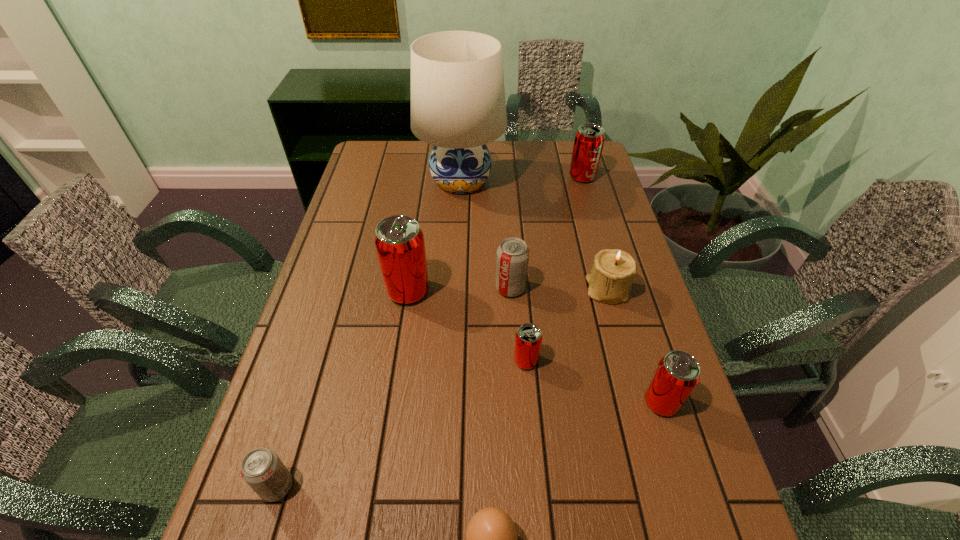
Find the location of a particular element. blank space located 0.190m on the back of the nearest red soda can is located at coordinates (636, 321).

Locate an element on the screen. This screenshot has height=540, width=960. free region located 0.080m on the left of the fourth nearest object is located at coordinates (480, 361).

Locate an element on the screen. vacant region located 0.140m on the back of the leftmost soda can is located at coordinates (301, 406).

Where is `lampshade located in the far edge section of the desktop`? Image resolution: width=960 pixels, height=540 pixels. lampshade located in the far edge section of the desktop is located at coordinates (458, 104).

Find the location of a particular element. This screenshot has height=540, width=960. soda can that is at the far edge is located at coordinates (589, 140).

Identify the location of object positioned at the left edge. (262, 469).

What are the coordinates of `candle_holder that is at the right edge` in the screenshot? It's located at (610, 280).

Locate an element on the screen. This screenshot has height=540, width=960. object that is at the far right corner is located at coordinates (589, 140).

Image resolution: width=960 pixels, height=540 pixels. Find the location of `vacant space at the far edge`. vacant space at the far edge is located at coordinates (498, 163).

At what (x,y) coordinates should I click in order to perform the action: click on free spot at the left edge of the desktop. Please return your answer as a coordinate pair (x, y). The width and height of the screenshot is (960, 540). Looking at the image, I should click on (376, 224).